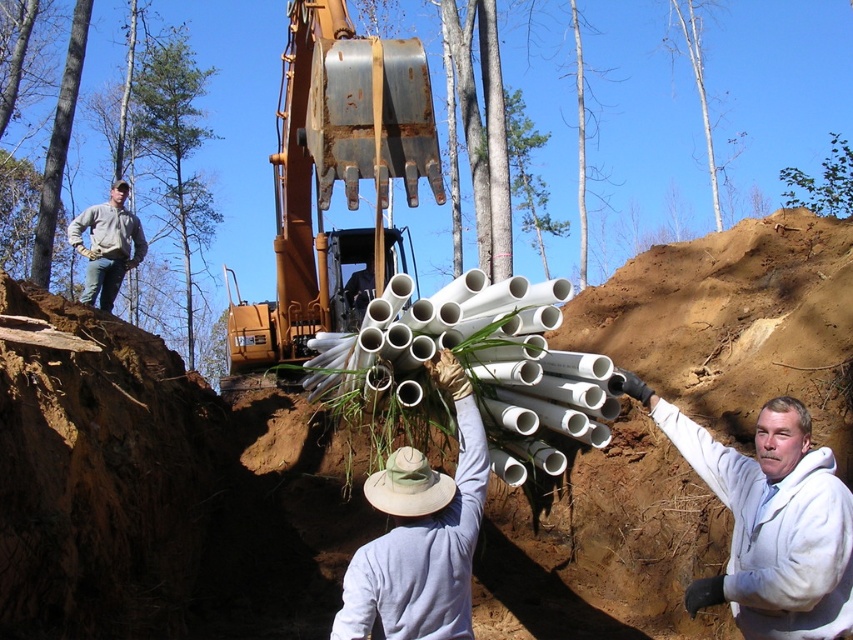
Question: Which object is farther from the camera taking this photo?

Choices:
 (A) white fleece jacket at right
 (B) white matte pipe at center
 (C) rusty metal excavator at center
 (D) gray fleece jacket at upper left

Answer: (D)

Question: Can you confirm if rusty metal excavator at center is thinner than white matte pipe at center?

Choices:
 (A) no
 (B) yes

Answer: (A)

Question: Does rusty metal excavator at center have a lesser width compared to white matte pipe at center?

Choices:
 (A) yes
 (B) no

Answer: (B)

Question: Which point is closer to the camera?

Choices:
 (A) (387, 593)
 (B) (113, 212)

Answer: (A)

Question: Among these objects, which one is nearest to the camera?

Choices:
 (A) white matte pipe at center
 (B) white fleece jacket at right

Answer: (B)

Question: Can you confirm if white fleece jacket at right is smaller than gray fleece jacket at upper left?

Choices:
 (A) no
 (B) yes

Answer: (B)